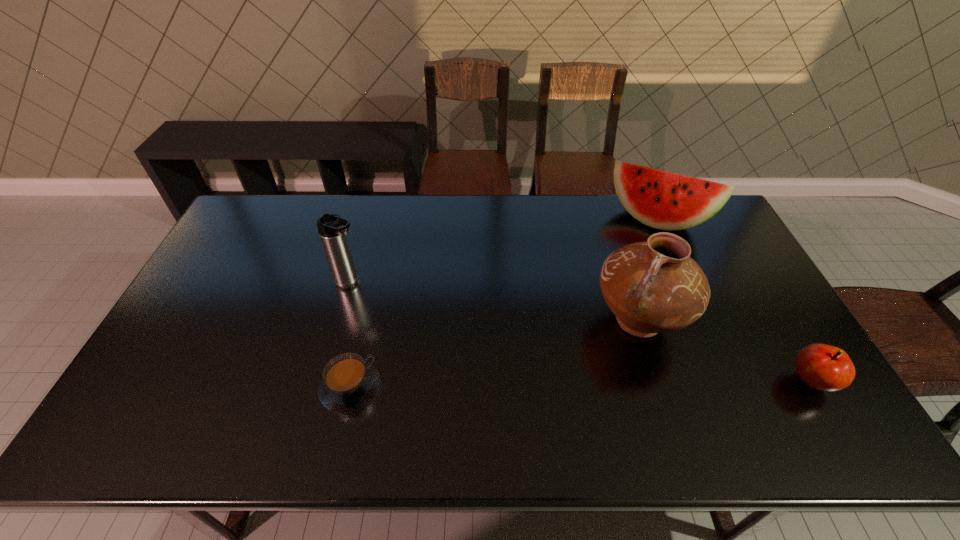
This screenshot has height=540, width=960. What are the coordinates of `free spot on the desktop that is between the cappuccino and the apple and is positioned on the handle side of the thermos bottle` in the screenshot? It's located at (531, 385).

Where is `free space on the desktop that is between the cappuccino and the second shortest object and is positioned on the outer rind of the farthest object`? This screenshot has width=960, height=540. free space on the desktop that is between the cappuccino and the second shortest object and is positioned on the outer rind of the farthest object is located at coordinates (588, 384).

Find the location of a particular element. The image size is (960, 540). free spot on the desktop that is between the cappuccino and the apple and is positioned on the side of the pottery with the handle is located at coordinates (581, 384).